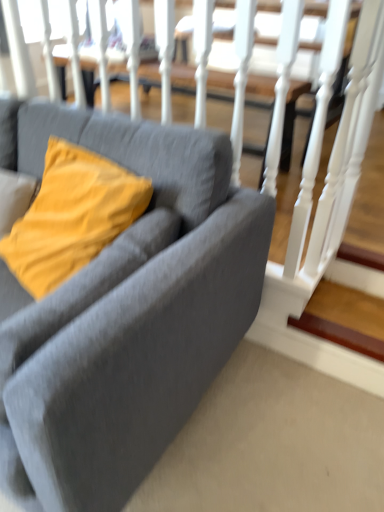
Question: From the image's perspective, is matte gray couch at center beneath matte yellow pillow at left?

Choices:
 (A) no
 (B) yes

Answer: (B)

Question: Considering the relative sizes of matte gray couch at center and matte yellow pillow at left in the image provided, is matte gray couch at center smaller than matte yellow pillow at left?

Choices:
 (A) yes
 (B) no

Answer: (B)

Question: Is matte gray couch at center aimed at matte yellow pillow at left?

Choices:
 (A) no
 (B) yes

Answer: (B)

Question: From a real-world perspective, is matte gray couch at center under matte yellow pillow at left?

Choices:
 (A) yes
 (B) no

Answer: (A)

Question: Is the position of matte gray couch at center more distant than that of matte yellow pillow at left?

Choices:
 (A) yes
 (B) no

Answer: (B)

Question: From a real-world perspective, is matte gray couch at center above or below matte yellow pillow at left?

Choices:
 (A) below
 (B) above

Answer: (A)

Question: Is matte gray couch at center in front of or behind matte yellow pillow at left in the image?

Choices:
 (A) behind
 (B) front

Answer: (B)

Question: Considering the relative positions of matte gray couch at center and matte yellow pillow at left in the image provided, is matte gray couch at center to the left or to the right of matte yellow pillow at left?

Choices:
 (A) right
 (B) left

Answer: (B)

Question: Is matte gray couch at center inside the boundaries of matte yellow pillow at left, or outside?

Choices:
 (A) outside
 (B) inside

Answer: (A)

Question: Considering the positions of wooden at lower right and matte gray couch at center in the image, is wooden at lower right taller or shorter than matte gray couch at center?

Choices:
 (A) tall
 (B) short

Answer: (B)

Question: Looking at their shapes, would you say wooden at lower right is wider or thinner than matte gray couch at center?

Choices:
 (A) thin
 (B) wide

Answer: (A)

Question: Looking at the image, does wooden at lower right seem bigger or smaller compared to matte gray couch at center?

Choices:
 (A) big
 (B) small

Answer: (B)

Question: Is wooden at lower right in front of or behind matte gray couch at center in the image?

Choices:
 (A) behind
 (B) front

Answer: (A)

Question: From the image's perspective, relative to matte yellow pillow at left, is wooden at lower right above or below?

Choices:
 (A) below
 (B) above

Answer: (A)

Question: Is wooden at lower right spatially inside matte yellow pillow at left, or outside of it?

Choices:
 (A) outside
 (B) inside

Answer: (A)